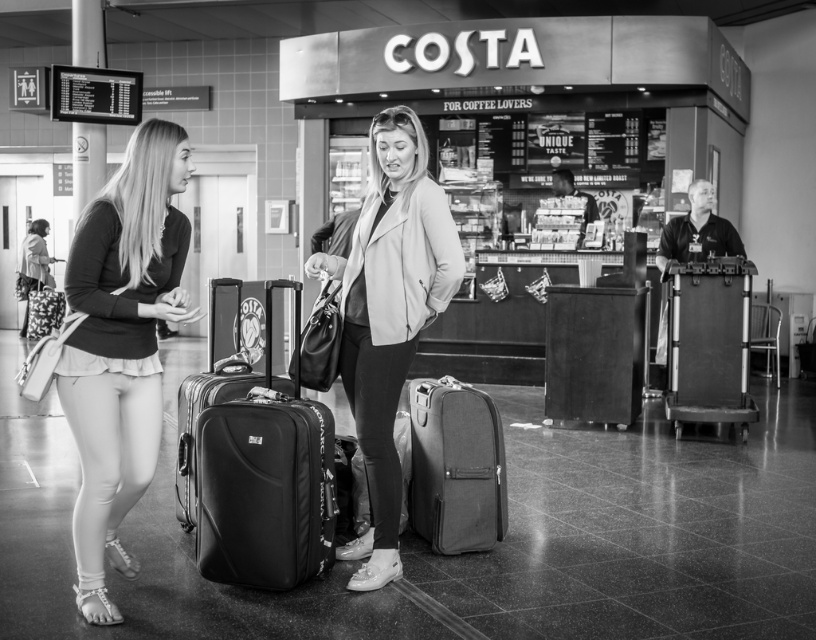
Based on the scene description, where is the canvas suitcase at center located in the image?

The canvas suitcase at center is located at point [455,467].

You are a traveler who just arrived at the airport. You see a leather jacket at center and a metallic suitcase at right. Which item is bigger in size?

The leather jacket at center is larger in size than the metallic suitcase at right.